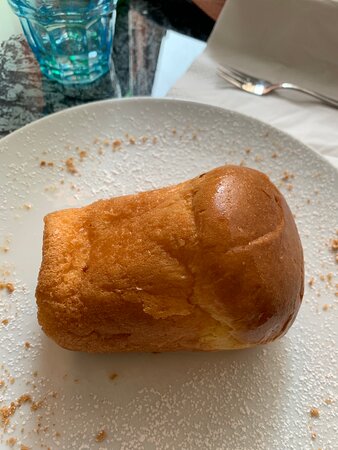
Locate an element on the screen. Image resolution: width=338 pixels, height=450 pixels. table is located at coordinates (26, 101).